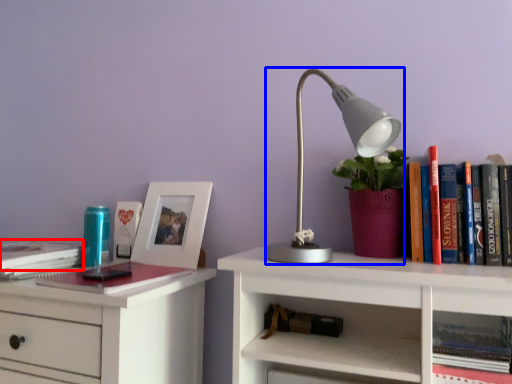
Question: Among these objects, which one is farthest to the camera, book (highlighted by a red box) or lamp (highlighted by a blue box)?

Choices:
 (A) book
 (B) lamp

Answer: (A)